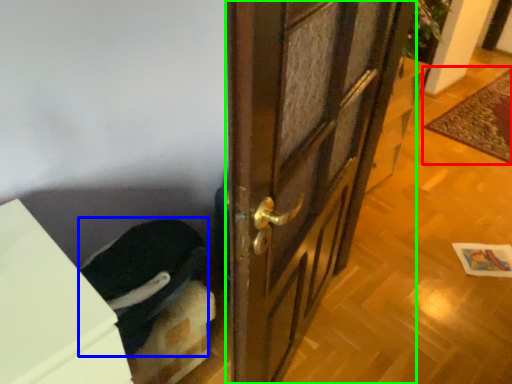
Question: Which object is the farthest from doormat (highlighted by a red box)? Choose among these: laundry (highlighted by a blue box) or door (highlighted by a green box).

Choices:
 (A) laundry
 (B) door

Answer: (A)